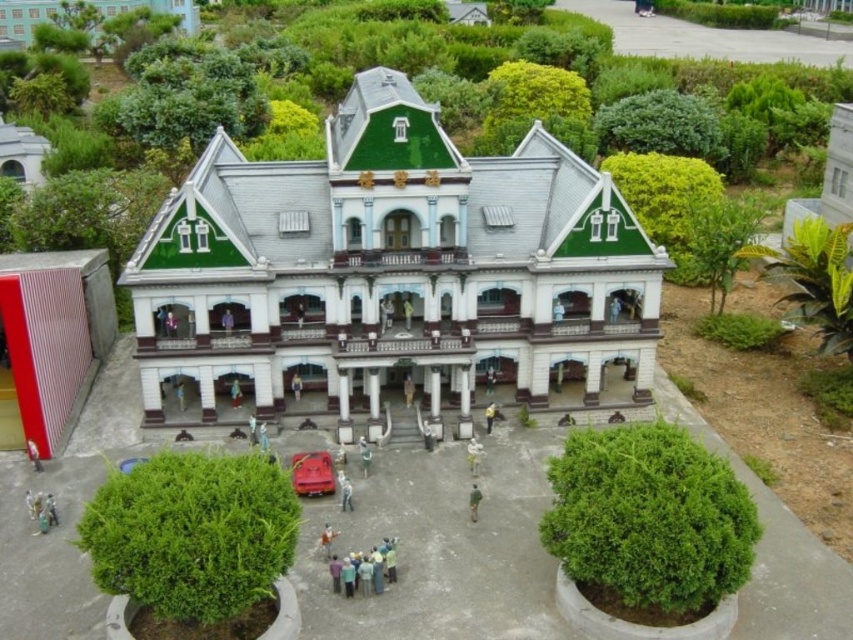
Who is more forward, (490, 404) or (299, 380)?

Positioned in front is point (299, 380).

Is yellow fabric person at center positioned behind light brown wooden door at center?

That is False.

This screenshot has width=853, height=640. In order to click on yellow fabric person at center in this screenshot , I will do `click(489, 417)`.

Does light brown wooden figure at center have a lesser height compared to matte white statue at center?

No, light brown wooden figure at center is not shorter than matte white statue at center.

Consider the image. Is light brown wooden figure at center above matte white statue at center?

No, light brown wooden figure at center is not above matte white statue at center.

Which is in front, point (236, 384) or point (230, 324)?

Point (230, 324)

Identify the location of light brown wooden figure at center. (235, 392).

Can you confirm if green matte dress at center is wider than light brown wooden door at center?

In fact, green matte dress at center might be narrower than light brown wooden door at center.

In the scene shown: Does green matte dress at center have a lesser height compared to light brown wooden door at center?

Incorrect, green matte dress at center's height does not fall short of light brown wooden door at center's.

This screenshot has width=853, height=640. What are the coordinates of `green matte dress at center` in the screenshot? It's located at (407, 312).